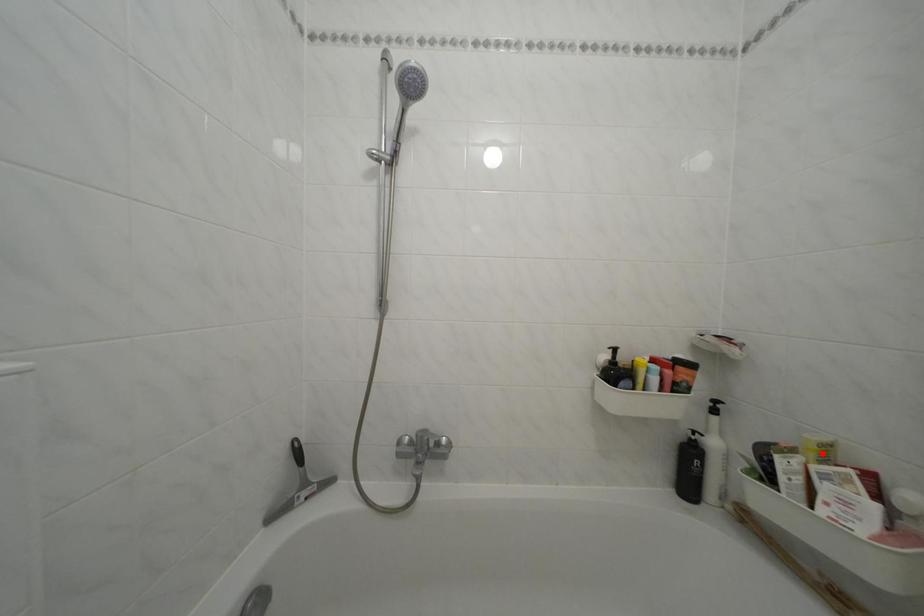
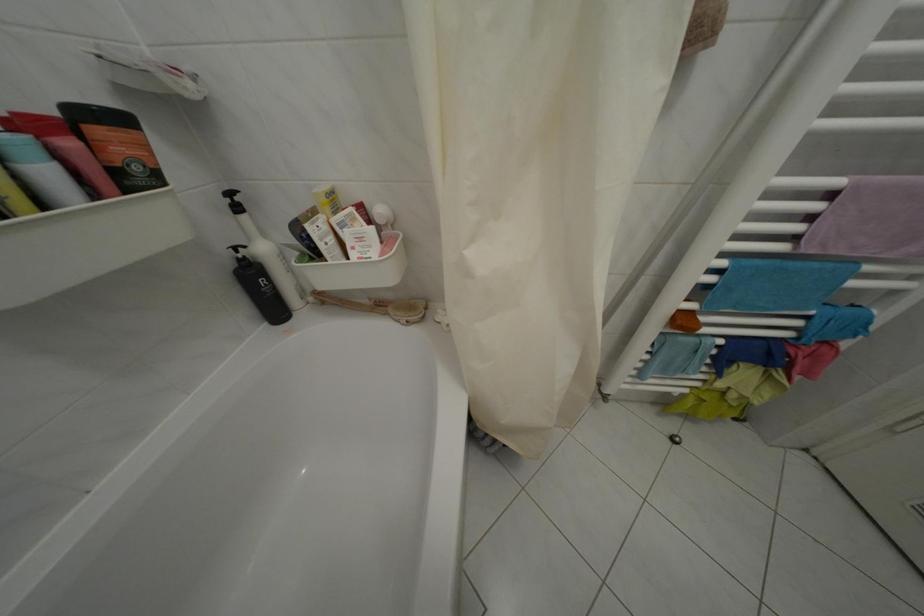
Locate, in the second image, the point that corresponds to the highlighted location in the first image.

(334, 206)